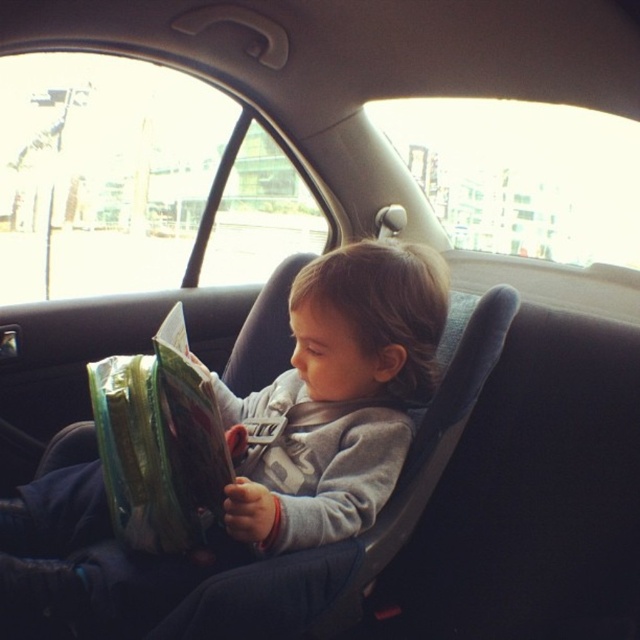
You are a parent trying to place a new toy in the car. You have a gray soft fabric toddler at center and a green plastic bag at center in the backseat. Which item takes up more space horizontally?

The gray soft fabric toddler at center takes up more space horizontally than the green plastic bag at center because the gray soft fabric toddler at center is wider.

You are a parent in the backseat of a car with your child. You have a green plastic bag at center and a gray soft fabric toddler at center. You want to hand the toddler a snack from the bag. Can you reach the toddler without moving your hand more than 5 inches?

The gray soft fabric toddler at center is 5.45 inches away from the green plastic bag at center. Since the distance is slightly over 5 inches, you cannot reach the toddler without moving your hand more than 5 inches.